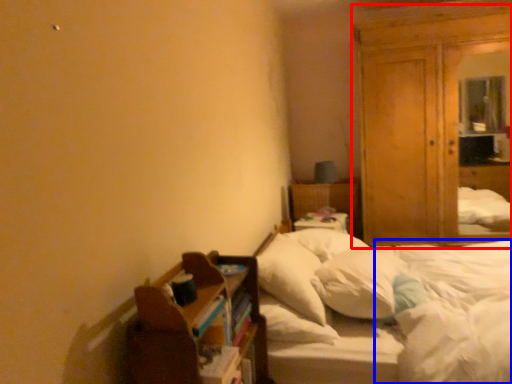
Question: Which of the following is the farthest to the observer, dresser (highlighted by a red box) or mattress (highlighted by a blue box)?

Choices:
 (A) dresser
 (B) mattress

Answer: (A)